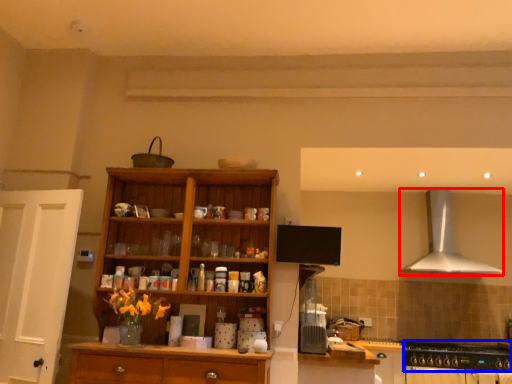
Question: Among these objects, which one is farthest to the camera, kitchen appliance (highlighted by a red box) or gas stove (highlighted by a blue box)?

Choices:
 (A) kitchen appliance
 (B) gas stove

Answer: (A)